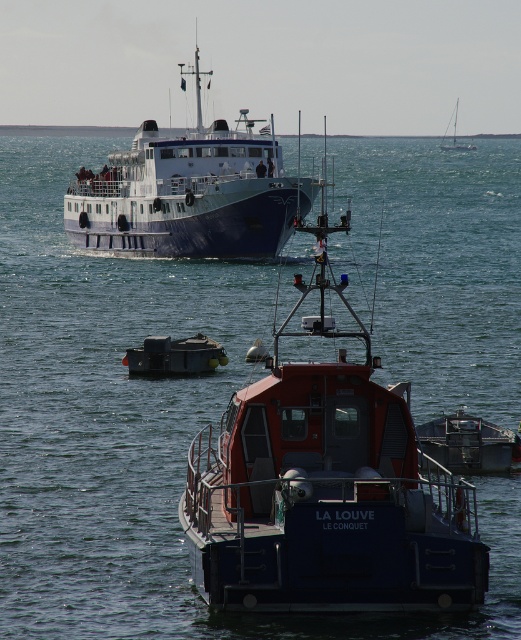
Who is positioned more to the right, blue matte ship at center or metallic gray buoy at center?

metallic gray buoy at center

Can you confirm if blue matte ship at center is positioned above metallic gray buoy at center?

Yes, blue matte ship at center is above metallic gray buoy at center.

This screenshot has width=521, height=640. What do you see at coordinates (190, 192) in the screenshot?
I see `blue matte ship at center` at bounding box center [190, 192].

The width and height of the screenshot is (521, 640). In order to click on blue matte ship at center in this screenshot , I will do `click(190, 192)`.

Which is more to the left, blue matte ship at center or white glossy sailboat at upper right?

From the viewer's perspective, blue matte ship at center appears more on the left side.

Describe the element at coordinates (190, 192) in the screenshot. Image resolution: width=521 pixels, height=640 pixels. I see `blue matte ship at center` at that location.

Between point (84, 205) and point (455, 138), which one is positioned behind?

The point (455, 138) is behind.

Find the location of `blue matte ship at center`. blue matte ship at center is located at coordinates (190, 192).

From the picture: Does metallic gray buoy at center appear under white glossy sailboat at upper right?

Yes.

Is metallic gray buoy at center taller than white glossy sailboat at upper right?

No.

Image resolution: width=521 pixels, height=640 pixels. Find the location of `metallic gray buoy at center`. metallic gray buoy at center is located at coordinates (175, 355).

Identify the location of metallic gray buoy at center. Image resolution: width=521 pixels, height=640 pixels. (175, 355).